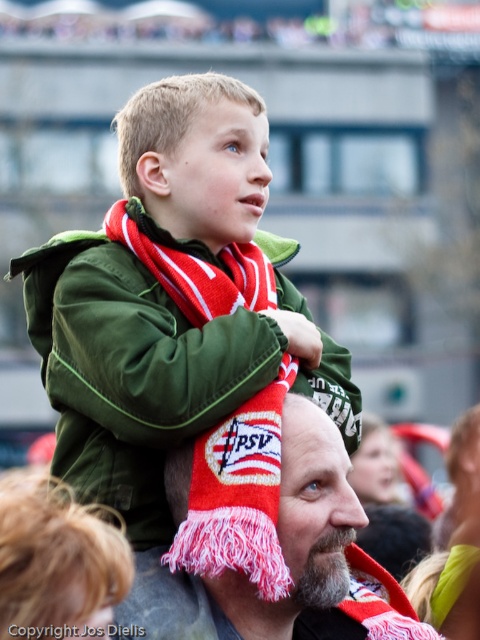
Who is lower down, knitted scarf at center or red/white striped scarf at upper center?

knitted scarf at center is below.

Does knitted scarf at center have a greater width compared to red/white striped scarf at upper center?

Yes.

Is point (288, 468) behind point (241, 492)?

Yes, it is.

Locate an element on the screen. The height and width of the screenshot is (640, 480). knitted scarf at center is located at coordinates (286, 563).

Can you confirm if red knitted scarf at center is shorter than red/white striped scarf at upper center?

No, red knitted scarf at center is not shorter than red/white striped scarf at upper center.

Is point (168, 179) positioned before point (249, 524)?

No, (168, 179) is behind (249, 524).

Where is `red knitted scarf at center`? The image size is (480, 640). red knitted scarf at center is located at coordinates (155, 371).

Who is positioned more to the left, red knitted scarf at center or knitted scarf at center?

red knitted scarf at center is more to the left.

Is point (196, 136) positioned after point (256, 618)?

Yes, point (196, 136) is farther from viewer.

The image size is (480, 640). I want to click on red knitted scarf at center, so click(x=155, y=371).